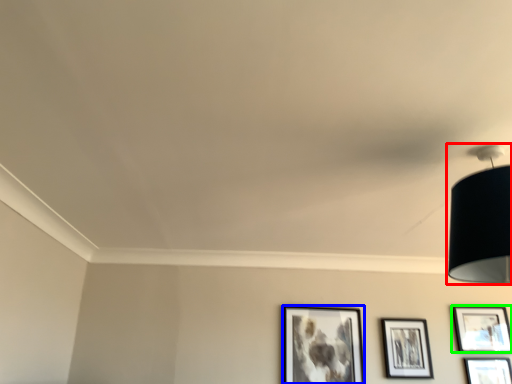
Question: Which object is the closest to the lamp (highlighted by a red box)? Choose among these: picture frame (highlighted by a blue box) or picture frame (highlighted by a green box).

Choices:
 (A) picture frame
 (B) picture frame

Answer: (A)